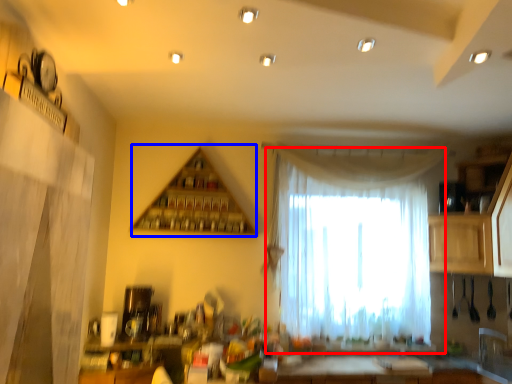
Question: Which of the following is the closest to the observer, curtain (highlighted by a red box) or shelf (highlighted by a blue box)?

Choices:
 (A) curtain
 (B) shelf

Answer: (B)